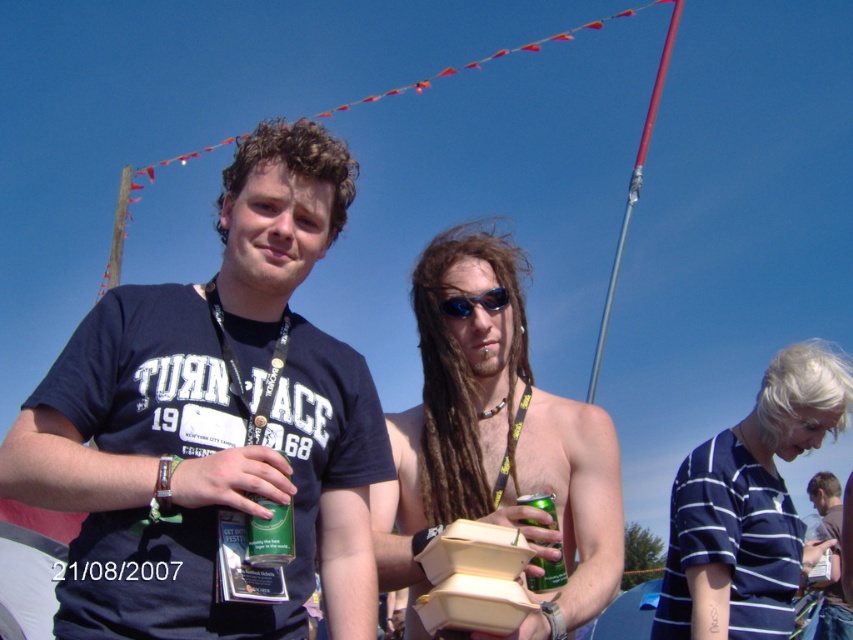
Question: Is gray fabric shirt at center bigger than green matte can at center?

Choices:
 (A) yes
 (B) no

Answer: (A)

Question: Which point appears farthest from the camera in this image?

Choices:
 (A) (149, 582)
 (B) (811, 502)
 (C) (560, 628)

Answer: (B)

Question: Which object is positioned closest to the matte blue t-shirt at center?

Choices:
 (A) green matte can at center
 (B) shiny silver can at center

Answer: (A)

Question: Can you confirm if blonde hair at lower right is positioned above blue reflective plastic sunglasses at center?

Choices:
 (A) yes
 (B) no

Answer: (B)

Question: Considering the real-world distances, which object is closest to the blonde hair at lower right?

Choices:
 (A) green matte can at center
 (B) green metallic can at center
 (C) matte blue t-shirt at center

Answer: (B)

Question: Can you confirm if green matte can at center is thinner than blue reflective plastic sunglasses at center?

Choices:
 (A) no
 (B) yes

Answer: (B)